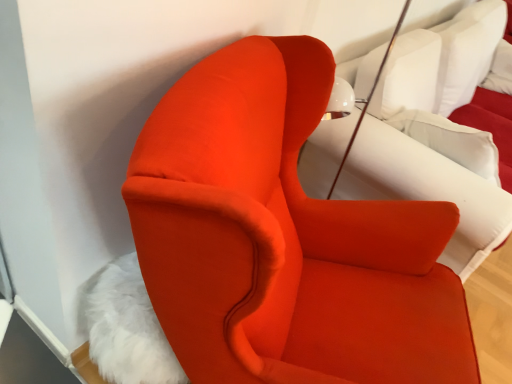
Question: Can you confirm if white fluffy rug at lower left is shorter than velvet white bed at center?

Choices:
 (A) no
 (B) yes

Answer: (B)

Question: Is white fluffy rug at lower left turned away from velvet white bed at center?

Choices:
 (A) no
 (B) yes

Answer: (A)

Question: Does white fluffy rug at lower left appear on the left side of velvet white bed at center?

Choices:
 (A) no
 (B) yes

Answer: (B)

Question: Is white fluffy rug at lower left further to camera compared to velvet white bed at center?

Choices:
 (A) no
 (B) yes

Answer: (A)

Question: From the image's perspective, does white fluffy rug at lower left appear lower than velvet white bed at center?

Choices:
 (A) no
 (B) yes

Answer: (B)

Question: Is white fluffy rug at lower left to the right of velvet white bed at center from the viewer's perspective?

Choices:
 (A) no
 (B) yes

Answer: (A)

Question: From a real-world perspective, is white fluffy rug at lower left on top of matte orange armchair at center?

Choices:
 (A) no
 (B) yes

Answer: (A)

Question: Can we say white fluffy rug at lower left lies outside matte orange armchair at center?

Choices:
 (A) yes
 (B) no

Answer: (B)

Question: Considering the relative sizes of white fluffy rug at lower left and matte orange armchair at center in the image provided, is white fluffy rug at lower left wider than matte orange armchair at center?

Choices:
 (A) no
 (B) yes

Answer: (A)

Question: Can you confirm if white fluffy rug at lower left is bigger than matte orange armchair at center?

Choices:
 (A) no
 (B) yes

Answer: (A)

Question: Is white fluffy rug at lower left taller than matte orange armchair at center?

Choices:
 (A) no
 (B) yes

Answer: (A)

Question: Does white fluffy rug at lower left have a lesser height compared to matte orange armchair at center?

Choices:
 (A) yes
 (B) no

Answer: (A)

Question: Does white soft pillow at upper right lie in front of white fluffy rug at lower left?

Choices:
 (A) no
 (B) yes

Answer: (A)